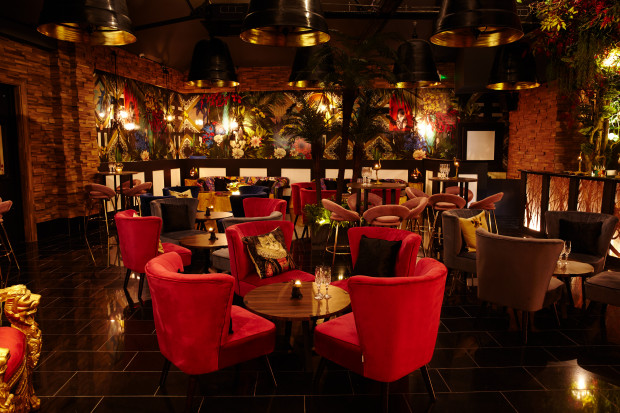
I want to click on curved red chair back, so click(190, 297), click(130, 236), click(410, 305).